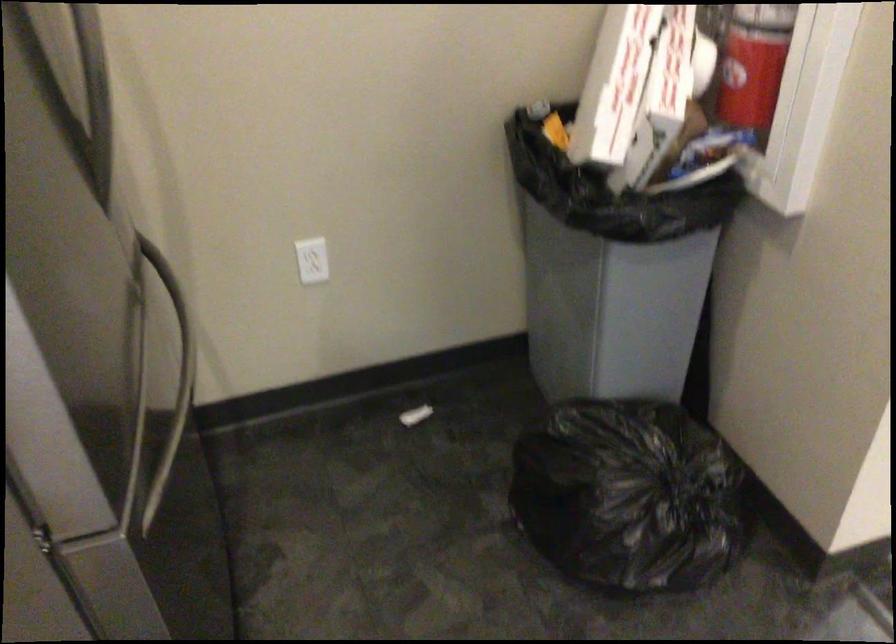
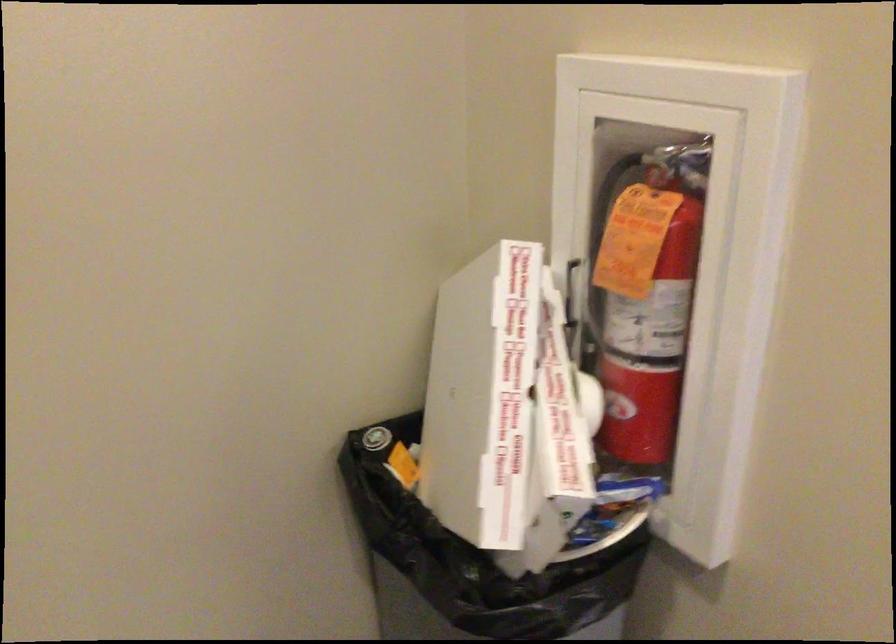
Find the pixel in the second image that matches the point at 664,73 in the first image.

(556, 444)